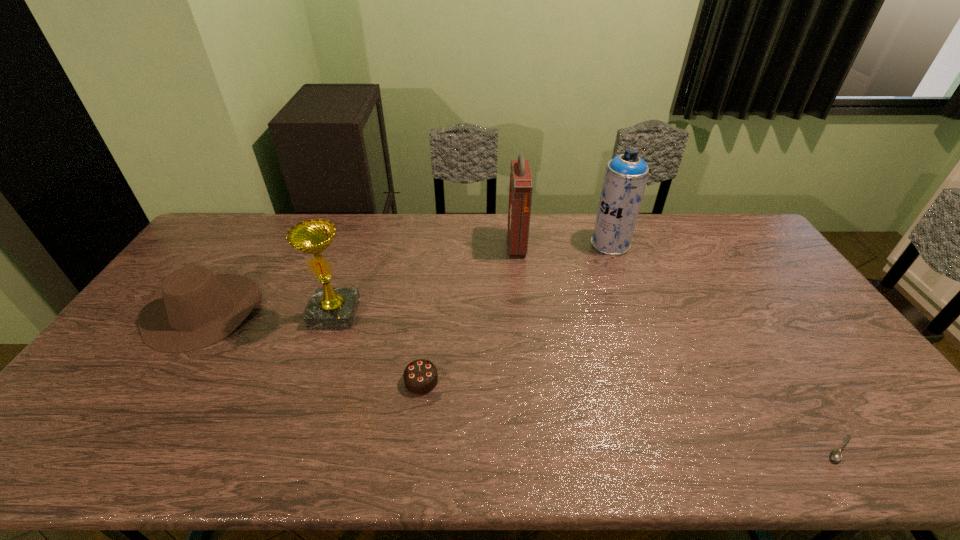
You are a GUI agent. You are given a task and a screenshot of the screen. Output one action in this format:
    pyautogui.click(x=<x>, y=<y>)
    Task: Click on the free point between the fifth object from right to left and the first-aid kit
    
    Given the screenshot: What is the action you would take?
    pyautogui.click(x=426, y=279)

The image size is (960, 540). What are the coordinates of `unoccupied area between the award and the chocolate cake` in the screenshot? It's located at (378, 347).

Locate an element on the screen. The width and height of the screenshot is (960, 540). blank region between the fourth object from right to left and the fourth tallest object is located at coordinates pyautogui.click(x=312, y=346).

Where is `free space between the fifth farthest object and the fourth tallest object`? The width and height of the screenshot is (960, 540). free space between the fifth farthest object and the fourth tallest object is located at coordinates (312, 346).

At what (x,y) coordinates should I click in order to perform the action: click on empty location between the third object from left to right and the award. Please return your answer as a coordinate pair (x, y). This screenshot has width=960, height=540. Looking at the image, I should click on (378, 347).

You are a GUI agent. You are given a task and a screenshot of the screen. Output one action in this format:
    pyautogui.click(x=<x>, y=<y>)
    Task: Click on the vacant space in between the soupspoon and the third object from right to left
    This screenshot has height=540, width=960.
    Given the screenshot: What is the action you would take?
    pyautogui.click(x=679, y=347)

At what (x,y) coordinates should I click in order to perform the action: click on vacant space that's between the aerosol can and the award. Please return your answer as a coordinate pair (x, y). Image resolution: width=960 pixels, height=540 pixels. Looking at the image, I should click on (472, 278).

You are a GUI agent. You are given a task and a screenshot of the screen. Output one action in this format:
    pyautogui.click(x=<x>, y=<y>)
    Task: Click on the free spot between the cowboy hat and the shortest object
    This screenshot has width=960, height=540.
    Given the screenshot: What is the action you would take?
    pyautogui.click(x=521, y=379)

Locate which object is the fourth closest to the second object from left to right. Please provide its 2D coordinates. Your answer should be formatted as a tuple, i.e. [(x, y)], where the tuple contains the x and y coordinates of a point satisfying the conditions above.

[(626, 175)]

Find the location of a particular element. The image size is (960, 540). object that is the fourth closest to the rightmost object is located at coordinates (330, 308).